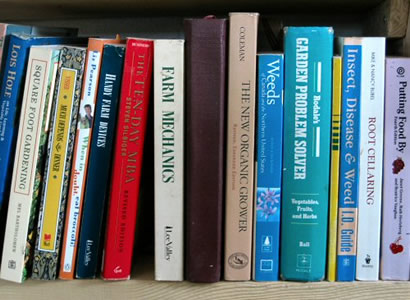
The image size is (410, 300). I want to click on blue books, so click(350, 97), click(271, 113), click(10, 78), click(100, 162).